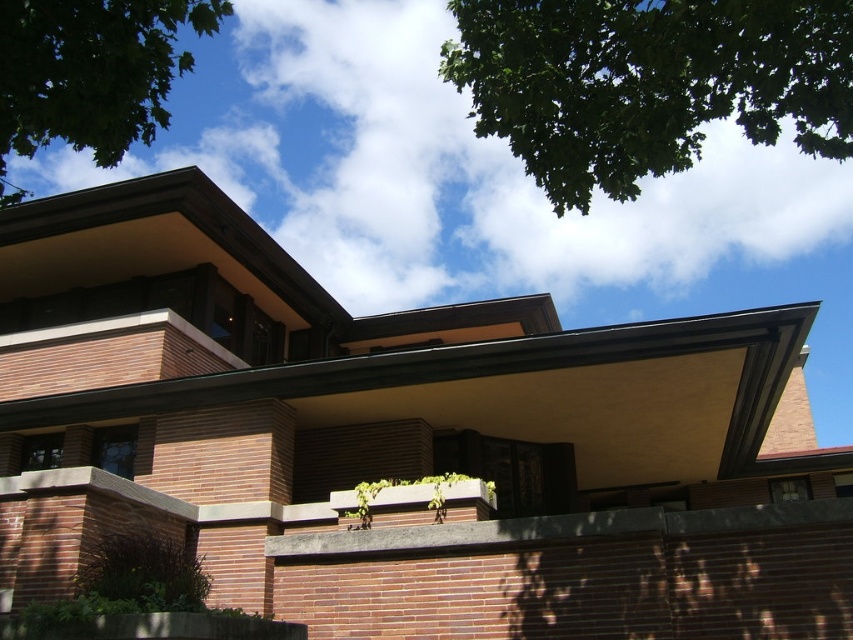
Question: Among these objects, which one is nearest to the camera?

Choices:
 (A) green leafy tree at upper center
 (B) green leafy tree at upper left

Answer: (B)

Question: Can you confirm if green leafy tree at upper center is positioned to the right of green leafy tree at upper left?

Choices:
 (A) no
 (B) yes

Answer: (B)

Question: Is green leafy tree at upper center to the right of green leafy tree at upper left from the viewer's perspective?

Choices:
 (A) yes
 (B) no

Answer: (A)

Question: Which object is closer to the camera taking this photo?

Choices:
 (A) green leafy tree at upper center
 (B) green leafy tree at upper left

Answer: (B)

Question: Can you confirm if green leafy tree at upper center is positioned to the right of green leafy tree at upper left?

Choices:
 (A) no
 (B) yes

Answer: (B)